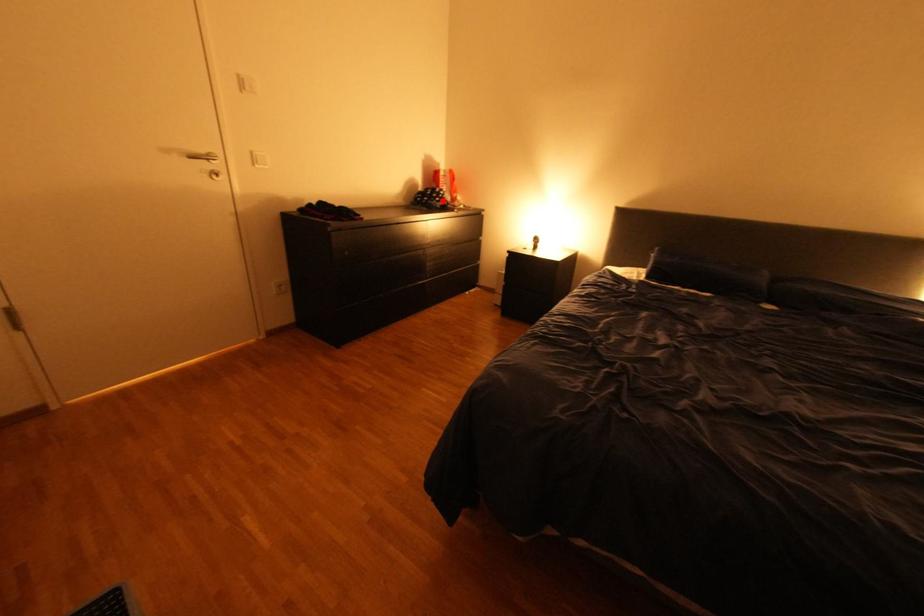
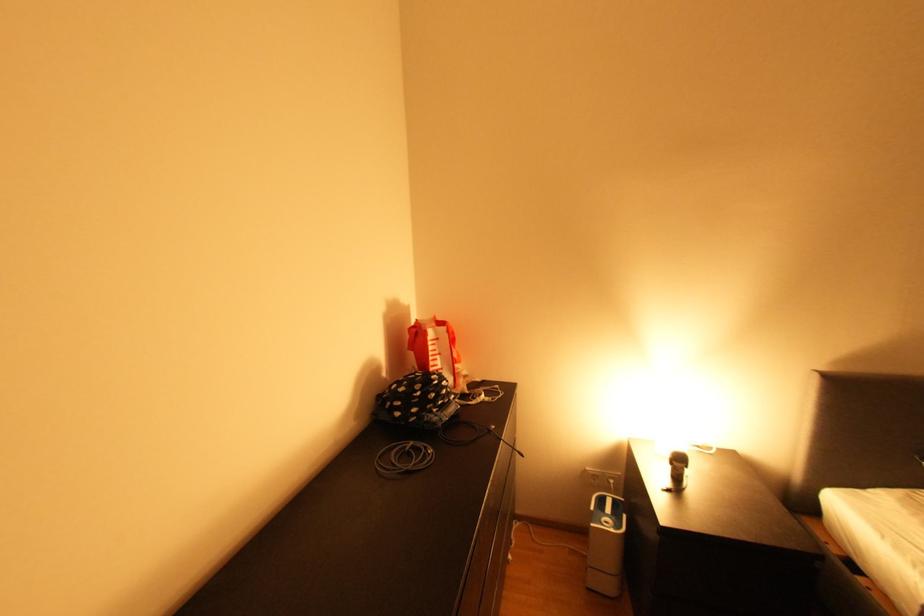
Question: I am providing you with two images of the same scene from different viewpoints. A red point is shown in image1. For the corresponding object point in image2, is it positioned nearer or farther from the camera?

Choices:
 (A) Nearer
 (B) Farther

Answer: (B)